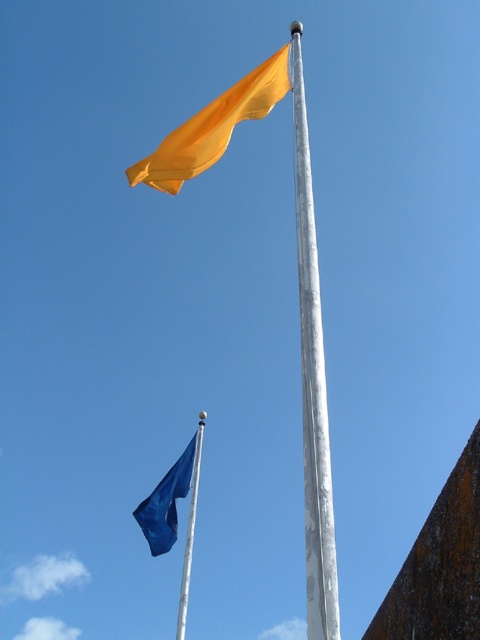
Which is below, silver metallic pole at center or matte yellow flag at upper center?

silver metallic pole at center is below.

Is silver metallic pole at center smaller than matte yellow flag at upper center?

Actually, silver metallic pole at center might be larger than matte yellow flag at upper center.

Is point (333, 512) farther from viewer compared to point (219, 129)?

No, it is not.

This screenshot has width=480, height=640. I want to click on silver metallic pole at center, so click(312, 387).

In the scene shown: Can you confirm if silver metallic pole at center is thinner than blue fabric flag at lower center?

Incorrect, silver metallic pole at center's width is not less than blue fabric flag at lower center's.

Is point (313, 360) closer to viewer compared to point (145, 497)?

Yes, it is.

Is point (325, 609) positioned behind point (158, 540)?

That is False.

You are a GUI agent. You are given a task and a screenshot of the screen. Output one action in this format:
    pyautogui.click(x=<x>, y=<y>)
    Task: Click on the silver metallic pole at center
    
    Given the screenshot: What is the action you would take?
    pyautogui.click(x=312, y=387)

Can you confirm if matte yellow flag at upper center is taller than blue fabric flag at lower center?

Yes.

Does point (228, 125) lie in front of point (196, 454)?

Yes.

Is point (227, 125) behind point (196, 435)?

No, it is in front of (196, 435).

The image size is (480, 640). Find the location of `matte yellow flag at upper center`. matte yellow flag at upper center is located at coordinates (213, 125).